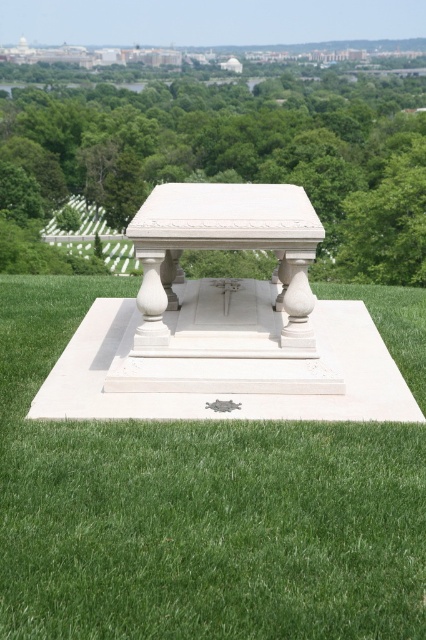
You are standing in the cemetery and want to place a wreath on the monument. Since both the green grass at center and the green leafy tree at center are in your path, which one do you need to move around to reach the monument?

The green grass at center is closer to the viewer than the green leafy tree at center, so you need to move around the green grass at center first to reach the monument.

You are standing in the cemetery and want to place a bouquet of flowers on the white marble table at center. However, you notice the green grass at center is in the way. Can you walk directly to the table without stepping on the grass?

The green grass at center is closer to the viewer than the white marble table at center, so you would have to step on the grass to reach the table.